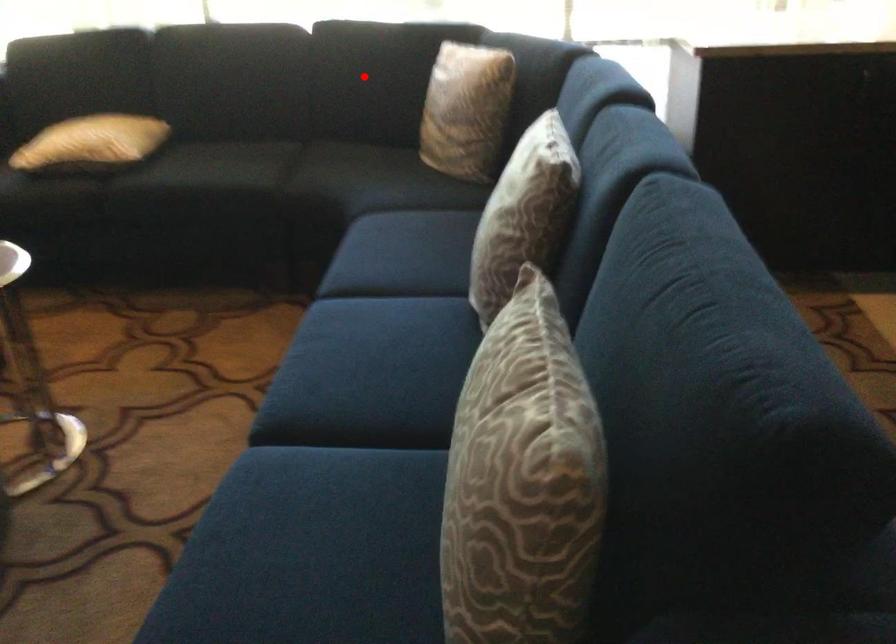
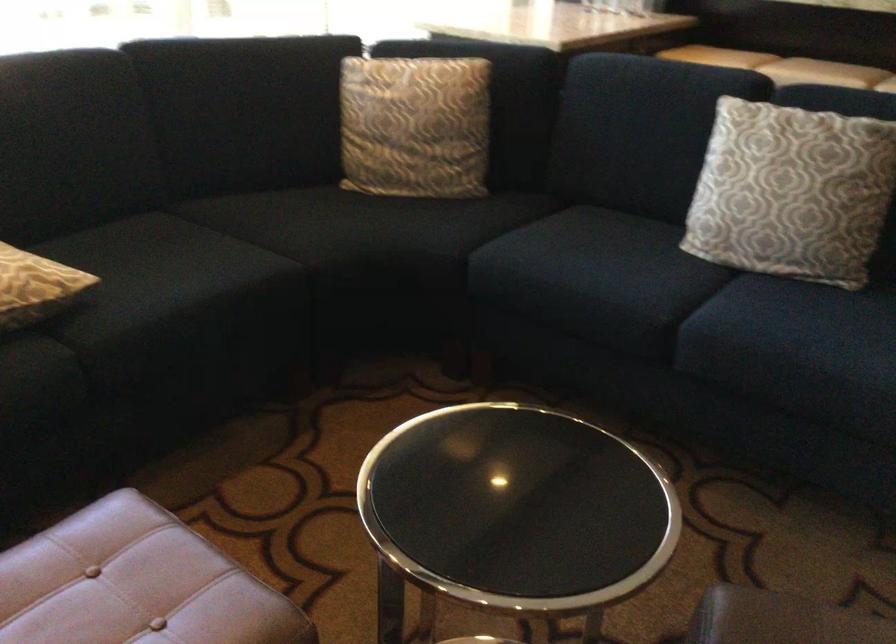
In the second image, find the point that corresponds to the highlighted location in the first image.

(238, 111)